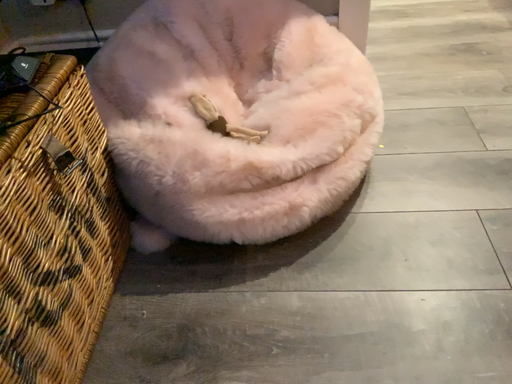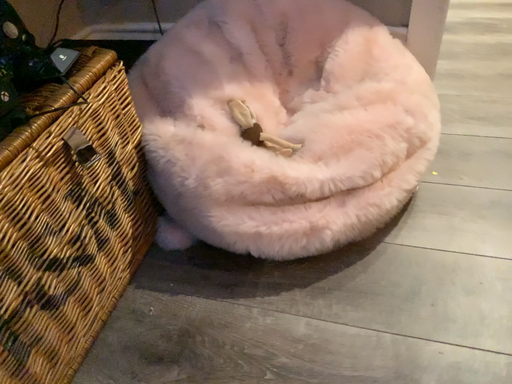
Question: How did the camera likely rotate when shooting the video?

Choices:
 (A) rotated left
 (B) rotated right

Answer: (A)